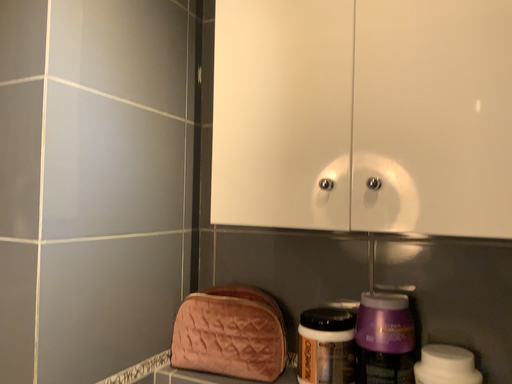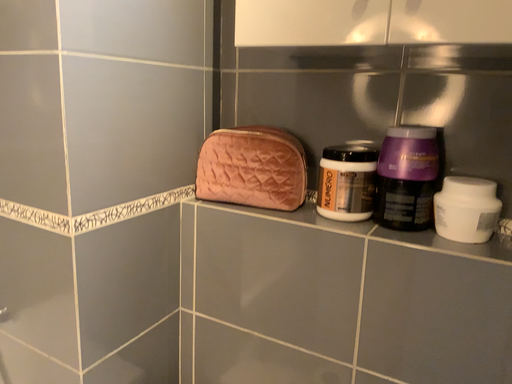
Question: How did the camera likely rotate when shooting the video?

Choices:
 (A) rotated upward
 (B) rotated downward

Answer: (B)